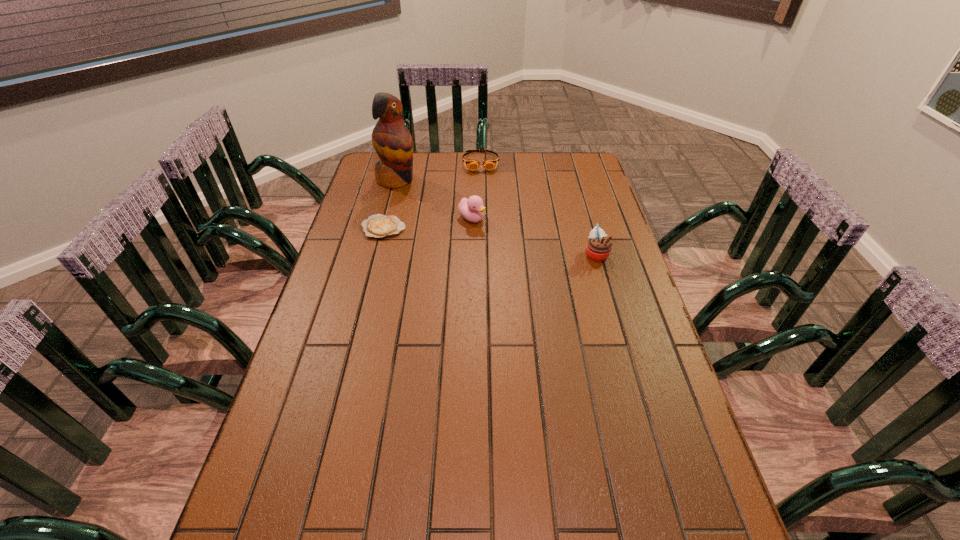
Identify the location of the shortest object. (378, 226).

Locate an element on the screen. The image size is (960, 540). the nearest object is located at coordinates (598, 248).

Locate an element on the screen. The image size is (960, 540). muffin is located at coordinates (598, 248).

Find the location of `duckling`. duckling is located at coordinates (472, 209).

Locate an element on the screen. Image resolution: width=960 pixels, height=540 pixels. the tallest object is located at coordinates [392, 141].

Locate an element on the screen. The image size is (960, 540). goggles is located at coordinates (489, 164).

The height and width of the screenshot is (540, 960). In order to click on vacant region located on the front of the quiche in this screenshot , I will do `click(370, 282)`.

In order to click on free space located 0.100m on the front-facing side of the duckling in this screenshot , I will do [504, 237].

Locate an element on the screen. free space located on the front-facing side of the duckling is located at coordinates (525, 249).

You are a GUI agent. You are given a task and a screenshot of the screen. Output one action in this format:
    pyautogui.click(x=<x>, y=<y>)
    Task: Click on the vacant space located 0.310m on the front-facing side of the duckling
    The image size is (960, 540).
    Given the screenshot: What is the action you would take?
    pyautogui.click(x=556, y=266)